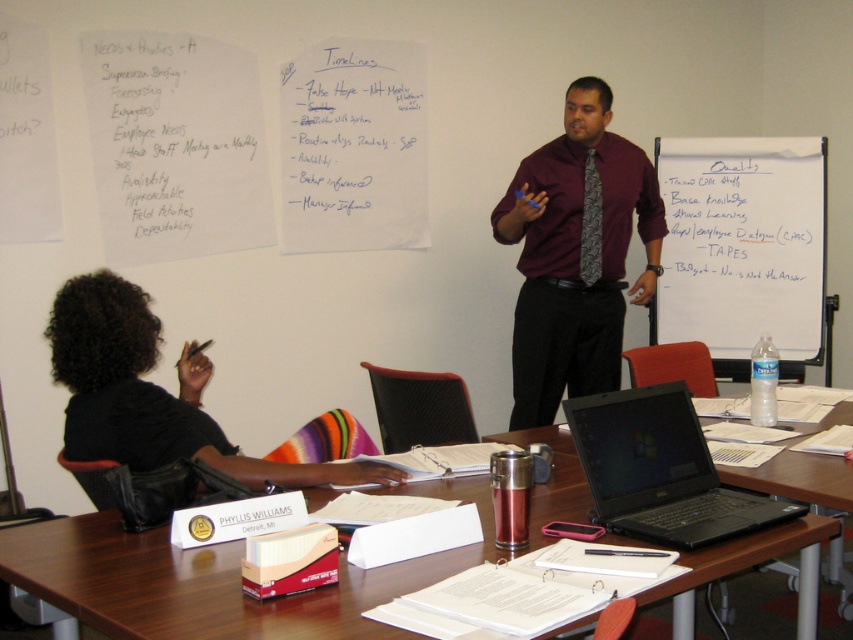
Is point (538, 337) less distant than point (599, 240)?

No, (538, 337) is behind (599, 240).

Who is more distant from viewer, (x=560, y=221) or (x=592, y=256)?

Positioned behind is point (x=592, y=256).

You are a GUI agent. You are given a task and a screenshot of the screen. Output one action in this format:
    pyautogui.click(x=<x>, y=<y>)
    Task: Click on the maroon shirt at center
    The image size is (853, 640).
    Given the screenshot: What is the action you would take?
    pyautogui.click(x=575, y=253)

Can you confirm if black matte laptop at center is positioned to the left of dark gray textured tie at center?

Yes, black matte laptop at center is to the left of dark gray textured tie at center.

Describe the element at coordinates (660, 470) in the screenshot. I see `black matte laptop at center` at that location.

This screenshot has width=853, height=640. Find the location of `black matte laptop at center`. black matte laptop at center is located at coordinates (660, 470).

Does whiteboard at upper right have a larger size compared to black fabric shirt at lower left?

Actually, whiteboard at upper right might be smaller than black fabric shirt at lower left.

Which is behind, point (709, 250) or point (143, 291)?

Positioned behind is point (709, 250).

You are a GUI agent. You are given a task and a screenshot of the screen. Output one action in this format:
    pyautogui.click(x=<x>, y=<y>)
    Task: Click on the whiteboard at upper right
    
    Given the screenshot: What is the action you would take?
    pos(746,250)